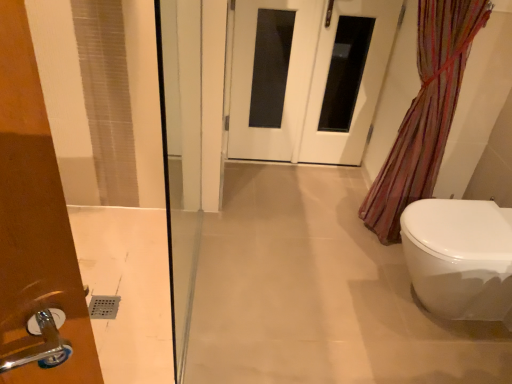
Where is `vacant space situated above white glossy toilet at lower right (from a real-world perspective)`? The image size is (512, 384). vacant space situated above white glossy toilet at lower right (from a real-world perspective) is located at coordinates (470, 228).